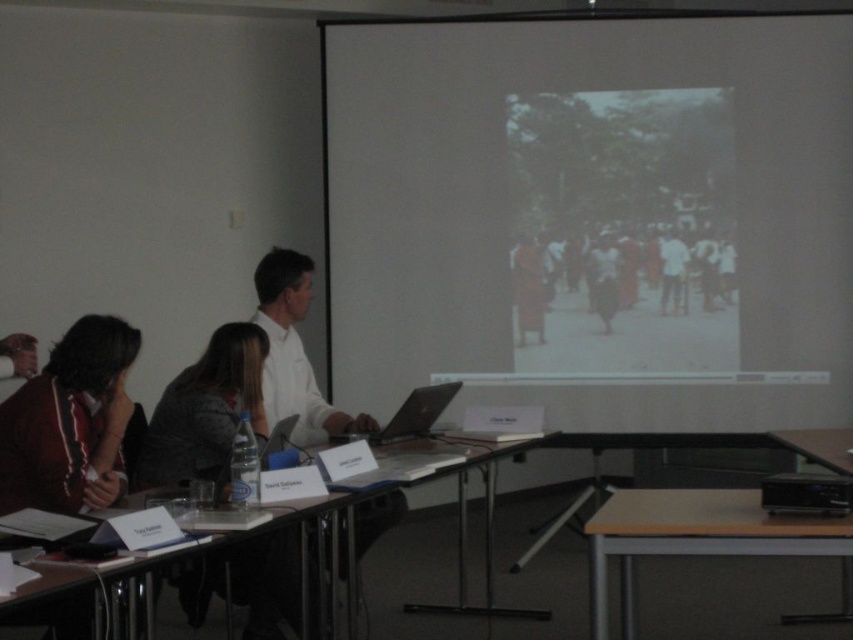
Question: Which object appears closest to the camera in this image?

Choices:
 (A) black plastic projector at lower right
 (B) light brown wood table at lower right
 (C) black matte laptop at center
 (D) patterned fabric jacket at lower left

Answer: (B)

Question: Is dark brown fabric at center positioned behind black matte laptop at center?

Choices:
 (A) no
 (B) yes

Answer: (B)

Question: Among these objects, which one is farthest from the camera?

Choices:
 (A) wooden table at lower left
 (B) dark brown fabric at center
 (C) white matte shirt at center
 (D) light brown wood table at lower right

Answer: (B)

Question: Is patterned fabric jacket at lower left further to the viewer compared to wooden table at lower left?

Choices:
 (A) no
 (B) yes

Answer: (A)

Question: In this image, where is white matte projection screen at upper center located relative to black plastic projector at lower right?

Choices:
 (A) left
 (B) right

Answer: (A)

Question: Which object is farther from the camera taking this photo?

Choices:
 (A) white matte shirt at center
 (B) white matte projection screen at upper center
 (C) dark brown fabric at center

Answer: (C)